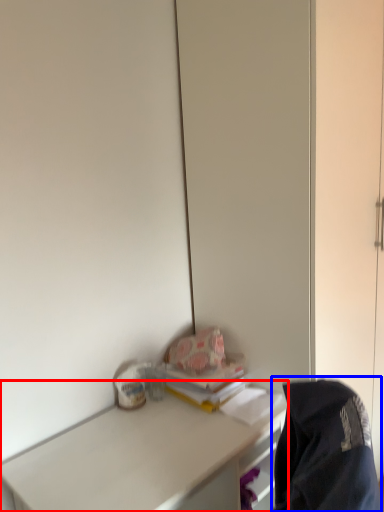
Question: Which object is closer to the camera taking this photo, desk (highlighted by a red box) or jacket (highlighted by a blue box)?

Choices:
 (A) desk
 (B) jacket

Answer: (B)